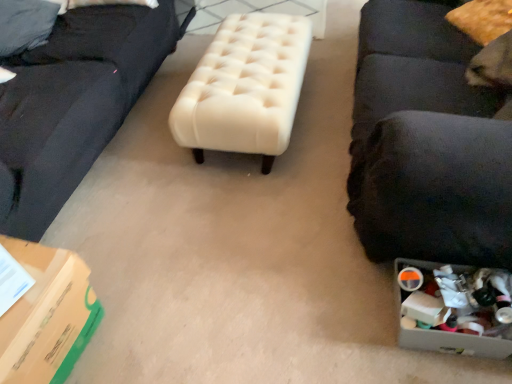
Question: From a real-world perspective, is creamy velvet ottoman at center located beneath black fabric studio couch at right?

Choices:
 (A) yes
 (B) no

Answer: (A)

Question: Considering the relative sizes of creamy velvet ottoman at center and black fabric studio couch at right in the image provided, is creamy velvet ottoman at center wider than black fabric studio couch at right?

Choices:
 (A) yes
 (B) no

Answer: (A)

Question: Can you confirm if creamy velvet ottoman at center is positioned to the left of black fabric studio couch at right?

Choices:
 (A) yes
 (B) no

Answer: (A)

Question: From a real-world perspective, is creamy velvet ottoman at center on black fabric studio couch at right?

Choices:
 (A) no
 (B) yes

Answer: (A)

Question: Is black fabric studio couch at right surrounded by creamy velvet ottoman at center?

Choices:
 (A) no
 (B) yes

Answer: (A)

Question: Is point (364, 41) positioned closer to the camera than point (52, 352)?

Choices:
 (A) farther
 (B) closer

Answer: (A)

Question: From a real-world perspective, is black fabric studio couch at right above or below green cardboard box at lower left?

Choices:
 (A) below
 (B) above

Answer: (B)

Question: Is black fabric studio couch at right taller or shorter than green cardboard box at lower left?

Choices:
 (A) short
 (B) tall

Answer: (B)

Question: Relative to green cardboard box at lower left, is black fabric studio couch at right in front or behind?

Choices:
 (A) front
 (B) behind

Answer: (A)

Question: Would you say black fabric studio couch at right is to the left or to the right of creamy velvet ottoman at center in the picture?

Choices:
 (A) left
 (B) right

Answer: (B)

Question: Considering the positions of black fabric studio couch at right and creamy velvet ottoman at center in the image, is black fabric studio couch at right wider or thinner than creamy velvet ottoman at center?

Choices:
 (A) thin
 (B) wide

Answer: (A)

Question: From the image's perspective, is black fabric studio couch at right above or below creamy velvet ottoman at center?

Choices:
 (A) above
 (B) below

Answer: (A)

Question: Which is correct: black fabric studio couch at right is inside creamy velvet ottoman at center, or outside of it?

Choices:
 (A) outside
 (B) inside

Answer: (A)

Question: From their relative heights in the image, would you say plastic container at lower right is taller or shorter than fuzzy yellow pillow at upper right?

Choices:
 (A) short
 (B) tall

Answer: (A)

Question: From the image's perspective, is plastic container at lower right above or below fuzzy yellow pillow at upper right?

Choices:
 (A) above
 (B) below

Answer: (B)